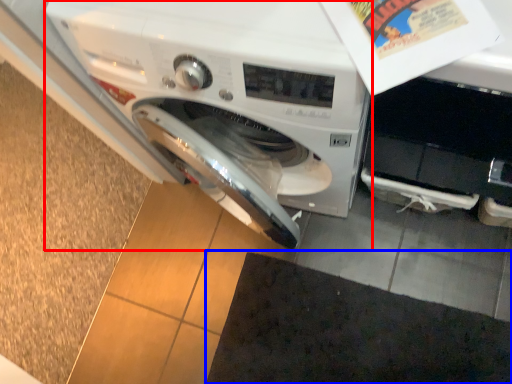
Question: Among these objects, which one is farthest to the camera, washing machine (highlighted by a red box) or doormat (highlighted by a blue box)?

Choices:
 (A) washing machine
 (B) doormat

Answer: (B)